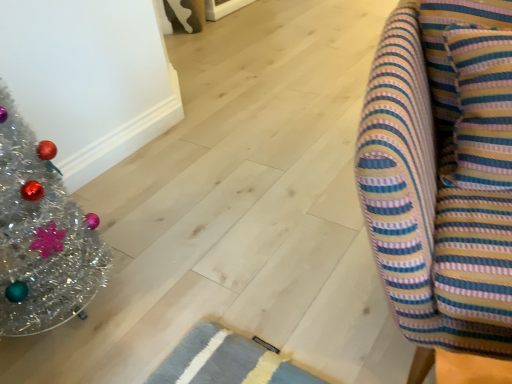
You are a GUI agent. You are given a task and a screenshot of the screen. Output one action in this format:
    pyautogui.click(x=<x>, y=<y>)
    Task: Click on the vacant space to the right of shiny silver christmas tree at left
    The width and height of the screenshot is (512, 384).
    Given the screenshot: What is the action you would take?
    pyautogui.click(x=173, y=280)